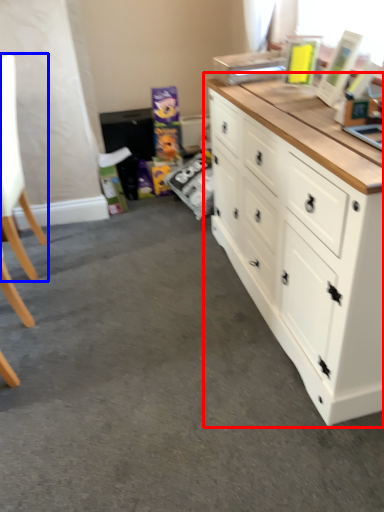
Question: Which object is closer to the camera taking this photo, chest of drawers (highlighted by a red box) or swivel chair (highlighted by a blue box)?

Choices:
 (A) chest of drawers
 (B) swivel chair

Answer: (A)